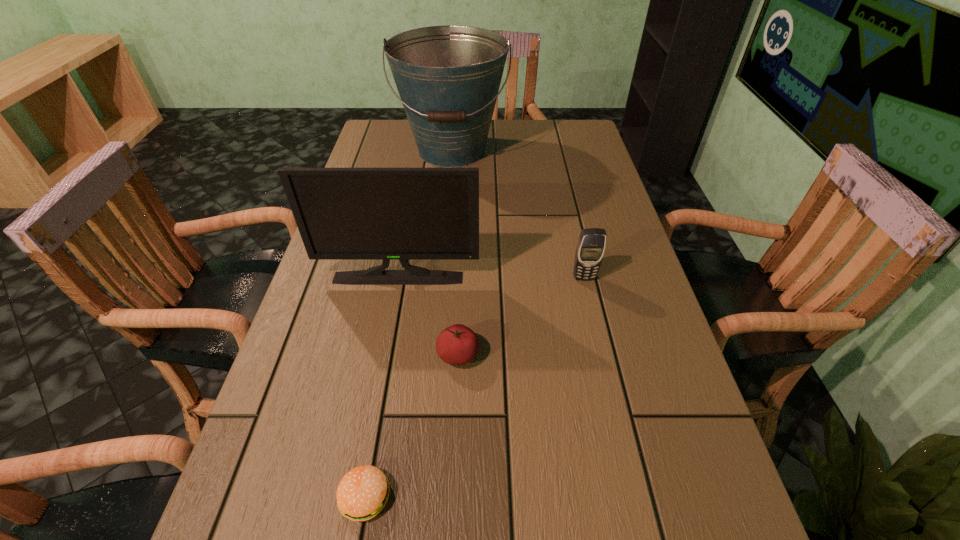
Identify the location of object that is the third closest to the tomato. (590, 249).

At what (x,y) coordinates should I click in order to perform the action: click on free space that satisfies the following two spatial constraints: 1. on the front-facing side of the shortest object; 2. on the right side of the monitor. Please return your answer as a coordinate pair (x, y). Looking at the image, I should click on (357, 496).

This screenshot has height=540, width=960. Find the location of `vacant region that satisfies the following two spatial constraints: 1. on the front-facing side of the patty; 2. on the left side of the monitor`. vacant region that satisfies the following two spatial constraints: 1. on the front-facing side of the patty; 2. on the left side of the monitor is located at coordinates (x=357, y=496).

Find the location of a particular element. This screenshot has height=540, width=960. free space that satisfies the following two spatial constraints: 1. on the front-facing side of the monitor; 2. on the left side of the nearest object is located at coordinates (357, 496).